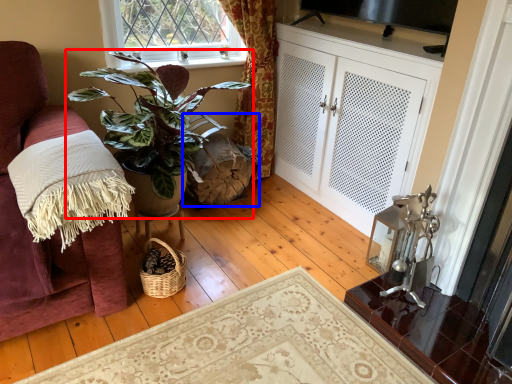
Question: Which object is further to the camera taking this photo, houseplant (highlighted by a red box) or swivel chair (highlighted by a blue box)?

Choices:
 (A) houseplant
 (B) swivel chair

Answer: (B)